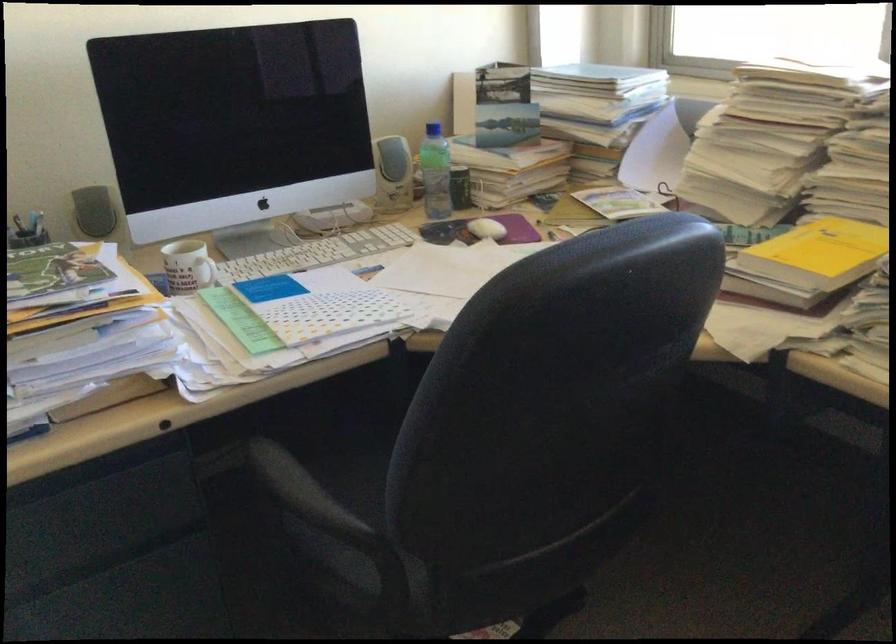
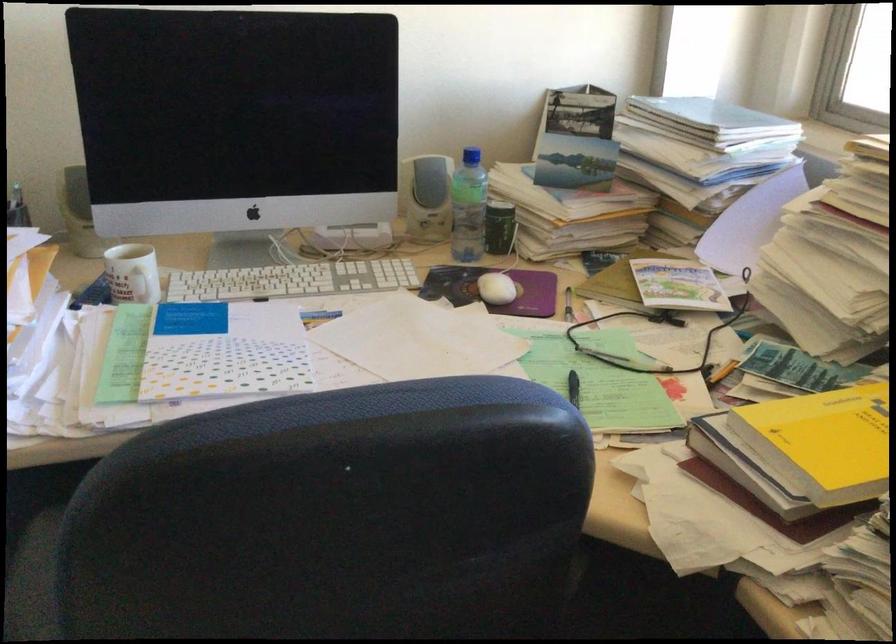
Which direction would the cameraman need to move to produce the second image?

The cameraman walked toward right, forward.